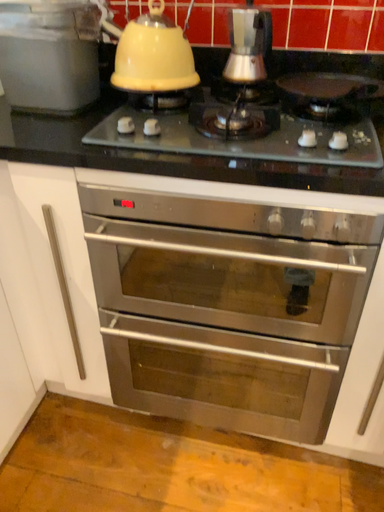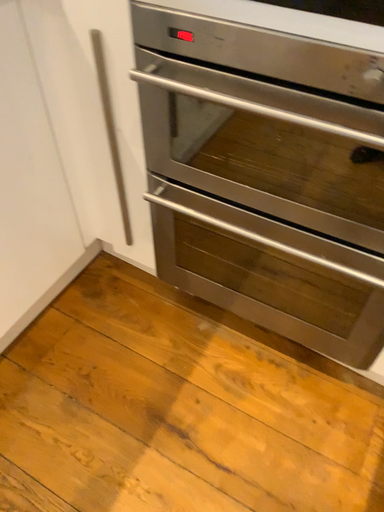
Question: How did the camera likely rotate when shooting the video?

Choices:
 (A) rotated upward
 (B) rotated downward

Answer: (B)